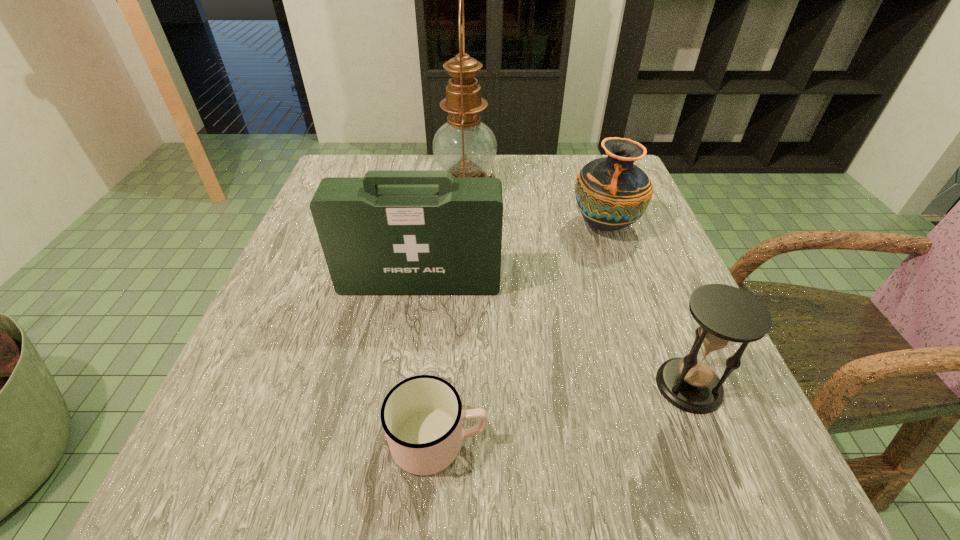
What are the coordinates of `free space between the shortest object and the oil lamp` in the screenshot? It's located at (452, 313).

Point out which object is positioned as the third nearest to the second tallest object. Please provide its 2D coordinates. Your answer should be formatted as a tuple, i.e. [(x, y)], where the tuple contains the x and y coordinates of a point satisfying the conditions above.

[(422, 416)]

I want to click on the third closest object to the second tallest object, so click(x=422, y=416).